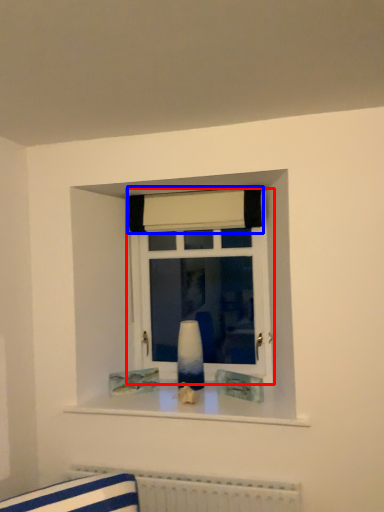
Question: Which object is closer to the camera taking this photo, window (highlighted by a red box) or curtain (highlighted by a blue box)?

Choices:
 (A) window
 (B) curtain

Answer: (B)